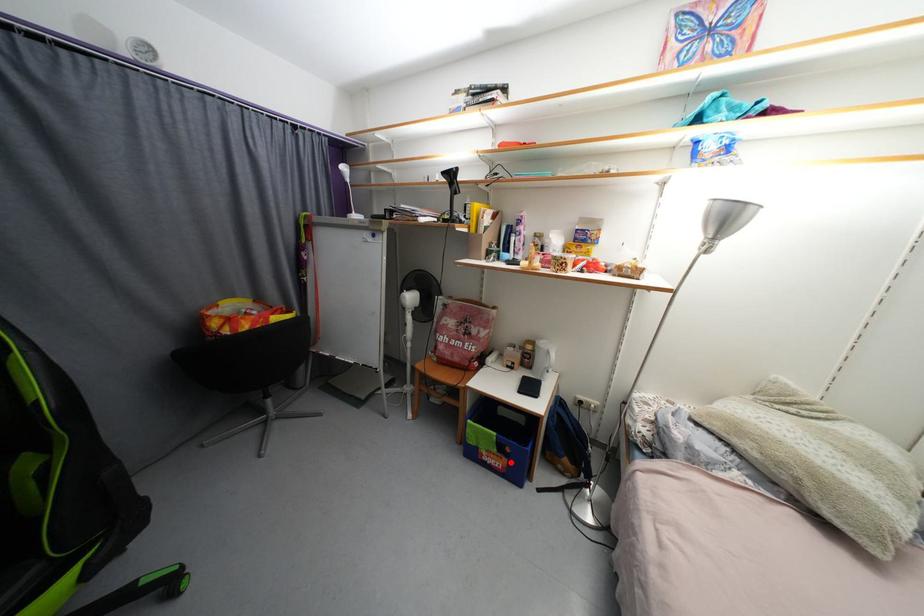
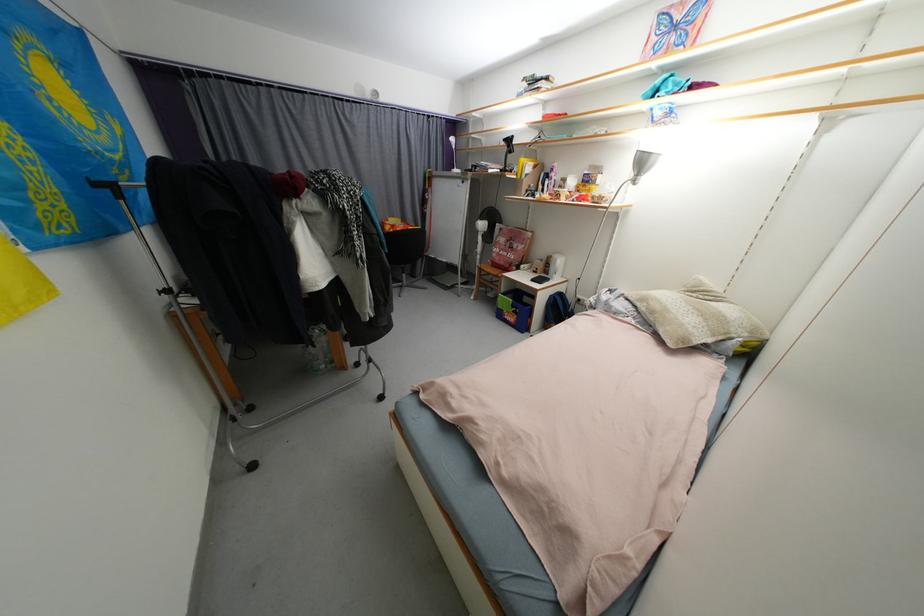
Question: I am providing you with two images of the same scene from different viewpoints. A red point is shown in image1. For the corresponding object point in image2, is it positioned nearer or farther from the camera?

Choices:
 (A) Nearer
 (B) Farther

Answer: (A)